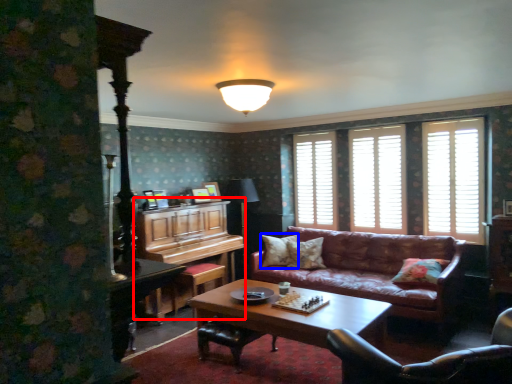
Question: Which object appears closest to the camera in this image, dresser (highlighted by a red box) or pillow (highlighted by a blue box)?

Choices:
 (A) dresser
 (B) pillow

Answer: (A)